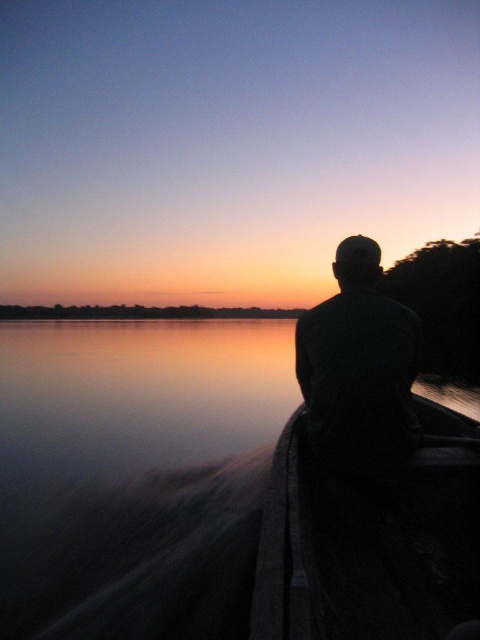
Question: Considering the real-world distances, which object is farthest from the smooth water at boat right?

Choices:
 (A) dark green fabric at center
 (B) dark wood canoe at right

Answer: (B)

Question: Does dark wood canoe at right appear under dark green fabric at center?

Choices:
 (A) yes
 (B) no

Answer: (A)

Question: Among these points, which one is nearest to the camera?

Choices:
 (A) coord(76,556)
 (B) coord(284,499)

Answer: (B)

Question: Where is smooth water at boat right located in relation to dark wood canoe at right in the image?

Choices:
 (A) right
 (B) left

Answer: (B)

Question: Which point is farther to the camera?

Choices:
 (A) dark green fabric at center
 (B) dark wood canoe at right

Answer: (A)

Question: Does smooth water at boat right have a lesser width compared to dark green fabric at center?

Choices:
 (A) no
 (B) yes

Answer: (A)